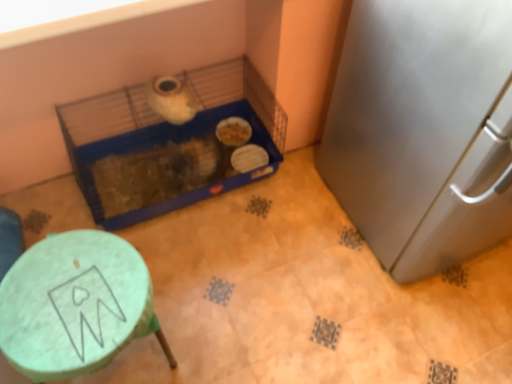
Image resolution: width=512 pixels, height=384 pixels. What are the coordinates of `vacant space to the right of blue plastic bird cage at center` in the screenshot? It's located at (292, 228).